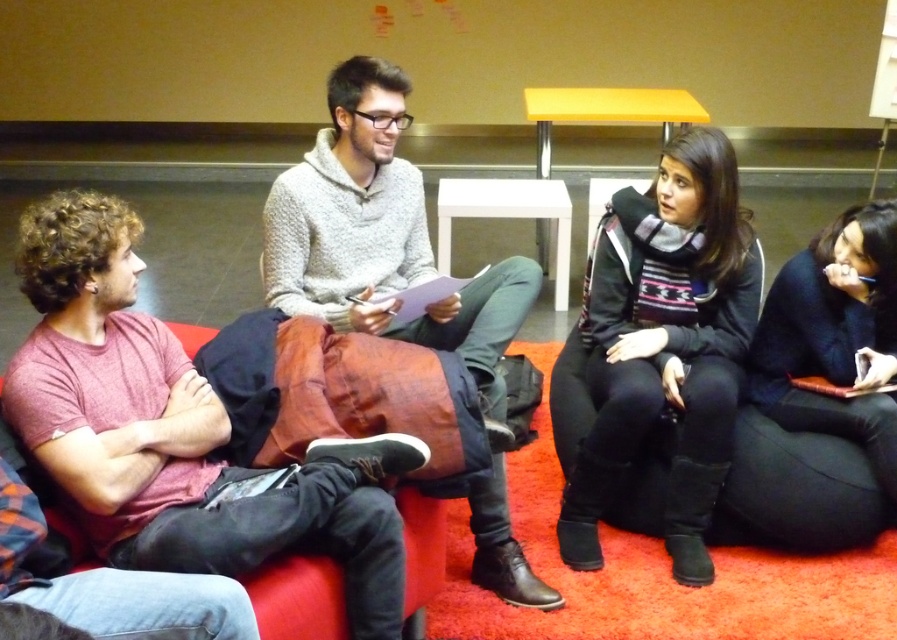
Question: In this image, where is matte red shirt at left located relative to black fabric bean bag chair at lower right?

Choices:
 (A) right
 (B) left

Answer: (B)

Question: Is matte red shirt at left thinner than black fabric bean bag chair at lower right?

Choices:
 (A) no
 (B) yes

Answer: (B)

Question: Does gray knit sweater at center appear on the left side of black fabric bean bag chair at lower right?

Choices:
 (A) no
 (B) yes

Answer: (B)

Question: Which point is farther from the camera taking this photo?

Choices:
 (A) (434, 308)
 (B) (127, 332)

Answer: (A)

Question: Which object is closer to the camera taking this photo?

Choices:
 (A) black fabric bean bag chair at lower right
 (B) gray knit sweater at center
 (C) matte red shirt at left

Answer: (C)

Question: Which of these objects is positioned farthest from the black woolen sweater at right?

Choices:
 (A) gray knit sweater at center
 (B) matte red shirt at left
 (C) black fabric bean bag chair at lower right

Answer: (B)